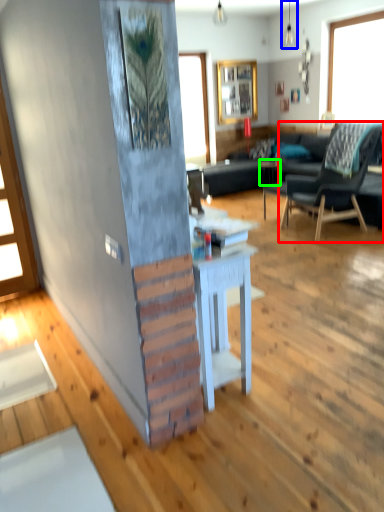
Question: Based on their relative distances, which object is nearer to chair (highlighted by a red box)? Choose from lamp (highlighted by a blue box) and side table (highlighted by a green box).

Choices:
 (A) lamp
 (B) side table

Answer: (B)